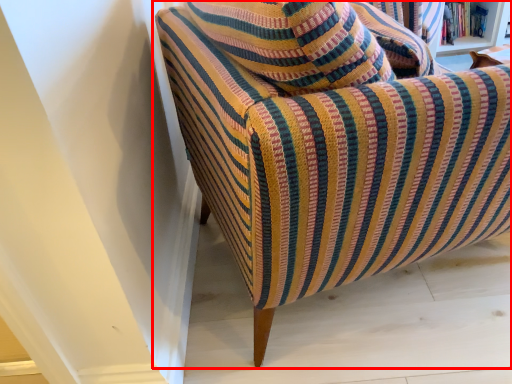
Question: From the image's perspective, where is chair (annotated by the red box) located relative to book?

Choices:
 (A) above
 (B) below

Answer: (B)